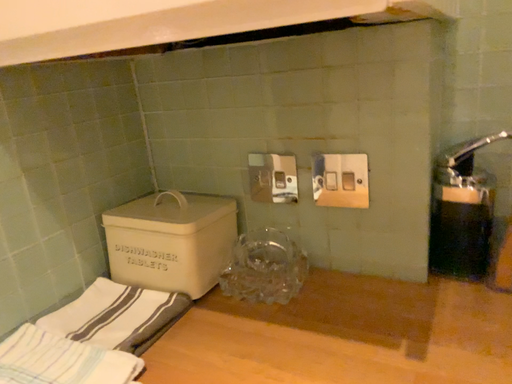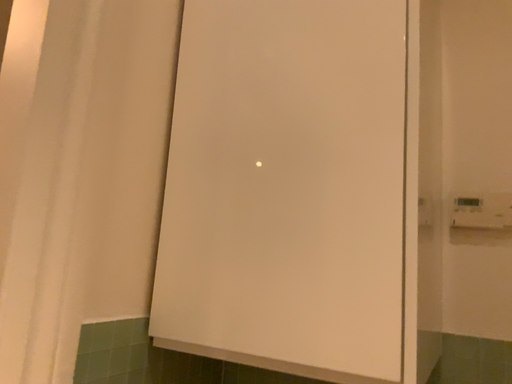
Question: How did the camera likely rotate when shooting the video?

Choices:
 (A) rotated downward
 (B) rotated upward

Answer: (B)